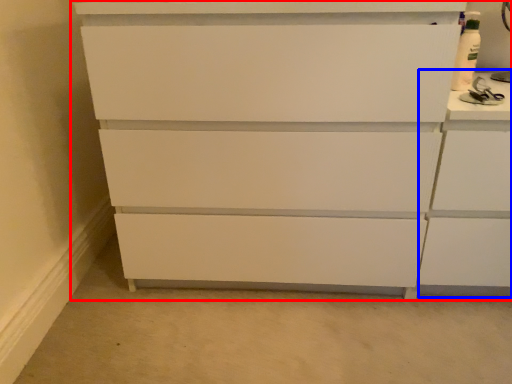
Question: Which point is closer to the camera, chest of drawers (highlighted by a red box) or cabinetry (highlighted by a blue box)?

Choices:
 (A) chest of drawers
 (B) cabinetry

Answer: (A)